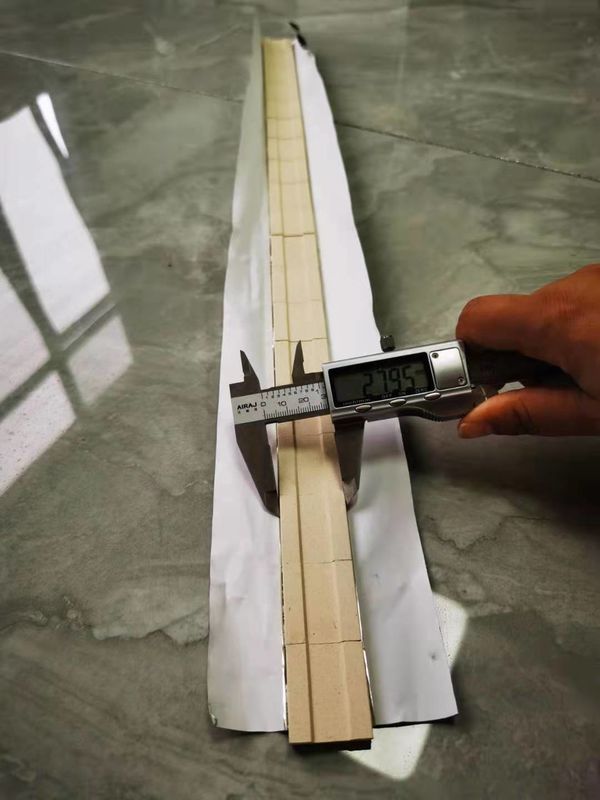
Identify the location of light marble. (165, 602).